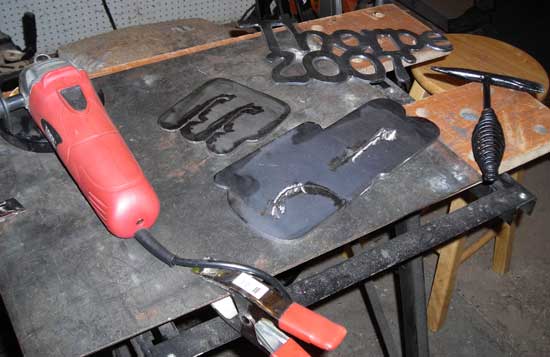
The height and width of the screenshot is (357, 550). In order to click on white wall with circles in this screenshot , I will do `click(77, 15)`.